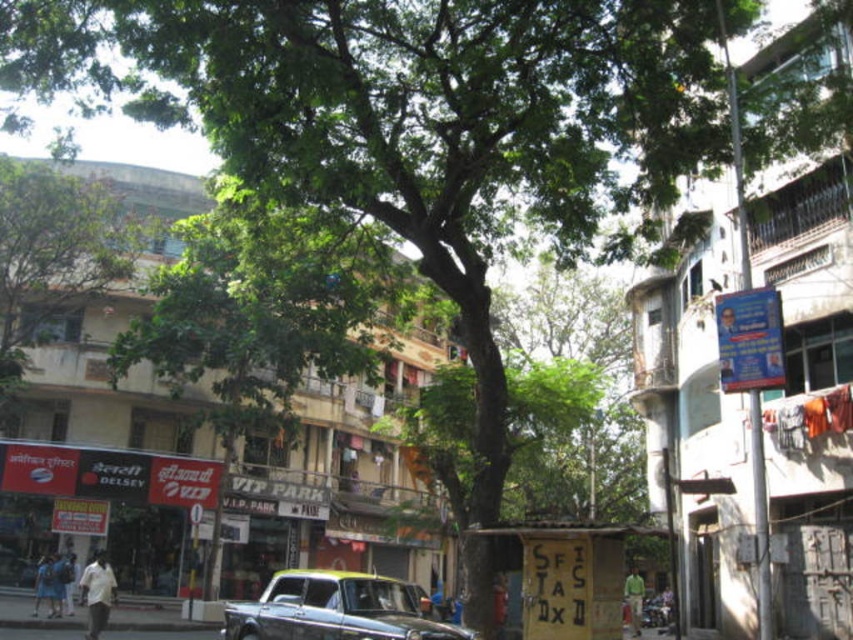
Between green leafy tree at center and metallic gray car at center, which one appears on the left side from the viewer's perspective?

green leafy tree at center

Can you confirm if green leafy tree at center is bigger than metallic gray car at center?

Yes, green leafy tree at center is bigger than metallic gray car at center.

Where is `green leafy tree at center`? green leafy tree at center is located at coordinates (265, 312).